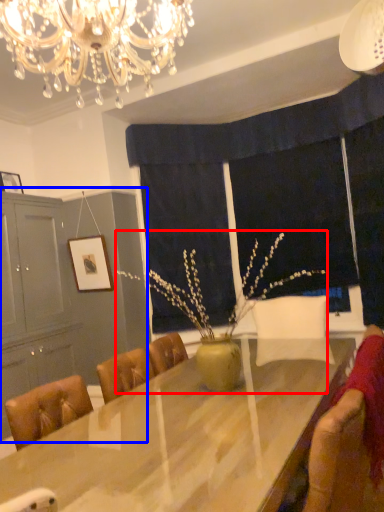
Question: Which of the following is the farthest to the observer, floral arrangement (highlighted by a red box) or dresser (highlighted by a blue box)?

Choices:
 (A) floral arrangement
 (B) dresser

Answer: (B)